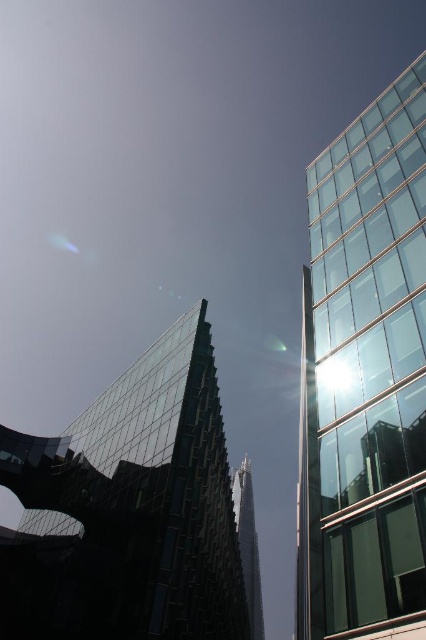
You are an architect analyzing the layout of the buildings in the image. Which building is positioned to the right side of the other between the transparent glass tower at right and the glassy steel tower at center?

The transparent glass tower at right is positioned to the left of the glassy steel tower at center, meaning the glassy steel tower at center is to the right of the transparent glass tower at right.

Based on the photo, you are standing at the point labeled as point [371,396]. You want to walk to the nearest building. Which building should you head towards?

The distance between the two buildings is 74.16 feet, so you should head towards the nearest one, which is the tall, angular structure in the foreground since it is closer to the point labeled as point [371,396] than the background building with the jagged silhouette.

You are an architect analyzing the layout of the buildings in the image. Which transparent glass tower is positioned higher in the scene, the transparent glass tower at right or the transparent glass tower at center?

The transparent glass tower at right is positioned higher in the scene than the transparent glass tower at center.